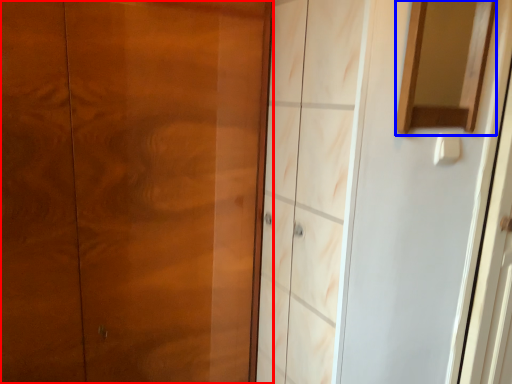
Question: Which of the following is the closest to the observer, door (highlighted by a red box) or mirror (highlighted by a blue box)?

Choices:
 (A) door
 (B) mirror

Answer: (A)